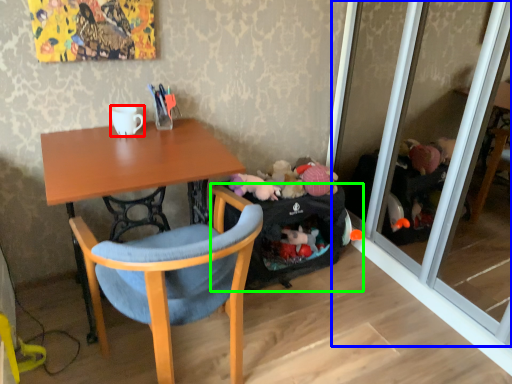
Question: Which object is positioned closest to coffee cup (highlighted by a red box)? Select from screen door (highlighted by a blue box) and luggage and bags (highlighted by a green box).

Choices:
 (A) screen door
 (B) luggage and bags

Answer: (B)